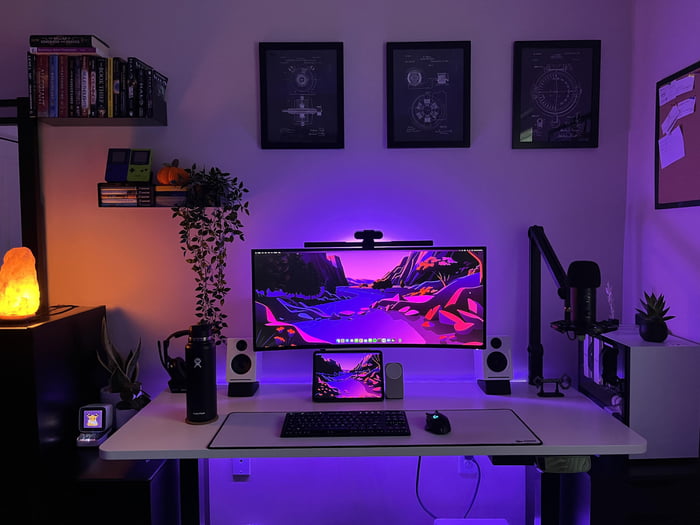
This screenshot has width=700, height=525. I want to click on computer mouse, so (x=444, y=426).